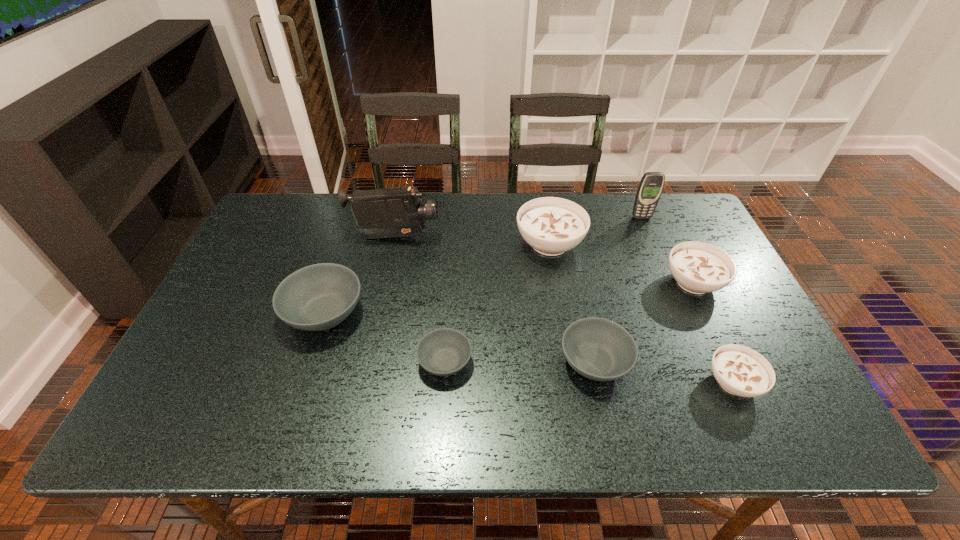
Identify the location of the second closest gray soup bowl to the cellular telephone. This screenshot has width=960, height=540. (442, 352).

The height and width of the screenshot is (540, 960). Identify the location of vacant space that satisfies the following two spatial constraints: 1. on the front-facing side of the camcorder; 2. on the left side of the second soup bowl from left to right. (369, 362).

I want to click on free space that satisfies the following two spatial constraints: 1. on the front-facing side of the black camcorder; 2. on the right side of the biggest white soup bowl, so click(x=394, y=244).

Find the location of a particular element. The width and height of the screenshot is (960, 540). vacant area in the image that satisfies the following two spatial constraints: 1. on the front-facing side of the black camcorder; 2. on the back side of the second smallest gray soup bowl is located at coordinates (369, 362).

Identify the location of vacant position in the image that satisfies the following two spatial constraints: 1. on the front-facing side of the second gray soup bowl from left to right; 2. on the left side of the black camcorder. (369, 362).

Identify the location of vacant region that satisfies the following two spatial constraints: 1. on the screen of the cellular telephone; 2. on the front-facing side of the camcorder. The width and height of the screenshot is (960, 540). (650, 237).